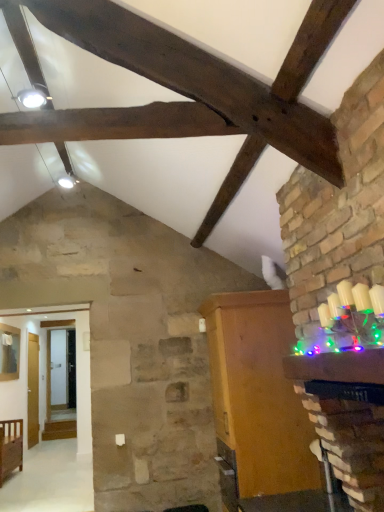
Question: Relative to brown wooden cabinet at upper center, is wooden cabinet at right, the 1th furniture when ordered from top to bottom, in front or behind?

Choices:
 (A) behind
 (B) front

Answer: (A)

Question: Is wooden cabinet at right, the 1th furniture when ordered from top to bottom, bigger or smaller than brown wooden cabinet at upper center?

Choices:
 (A) small
 (B) big

Answer: (B)

Question: Which object is positioned closest to the wooden crib at lower left, positioned as the first furniture in left-to-right order?

Choices:
 (A) wooden cabinet at right, the second furniture viewed from the back
 (B) brown wooden cabinet at upper center

Answer: (A)

Question: Which is nearer to the wooden cabinet at right, the second furniture from the bottom?

Choices:
 (A) wooden crib at lower left, positioned as the 2th furniture in right-to-left order
 (B) brown wooden cabinet at upper center

Answer: (B)